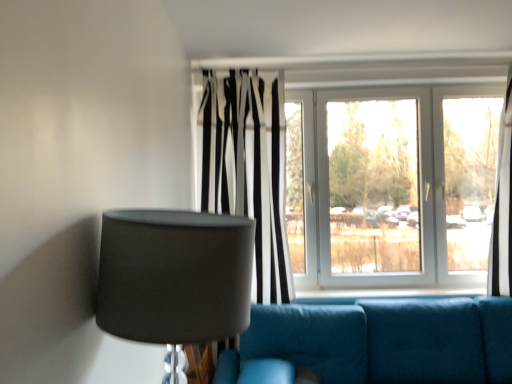
Question: From a real-world perspective, is teal fabric couch at lower center above or below white glossy window at center?

Choices:
 (A) above
 (B) below

Answer: (B)

Question: Is teal fabric couch at lower center inside the boundaries of white glossy window at center, or outside?

Choices:
 (A) outside
 (B) inside

Answer: (A)

Question: Which object is the closest to the white glossy window at center?

Choices:
 (A) teal fabric couch at lower center
 (B) black and white striped curtain at center
 (C) matte gray lampshade at left

Answer: (B)

Question: Considering the real-world distances, which object is closest to the matte gray lampshade at left?

Choices:
 (A) black and white striped curtain at center
 (B) white glossy window at center
 (C) teal fabric couch at lower center

Answer: (C)